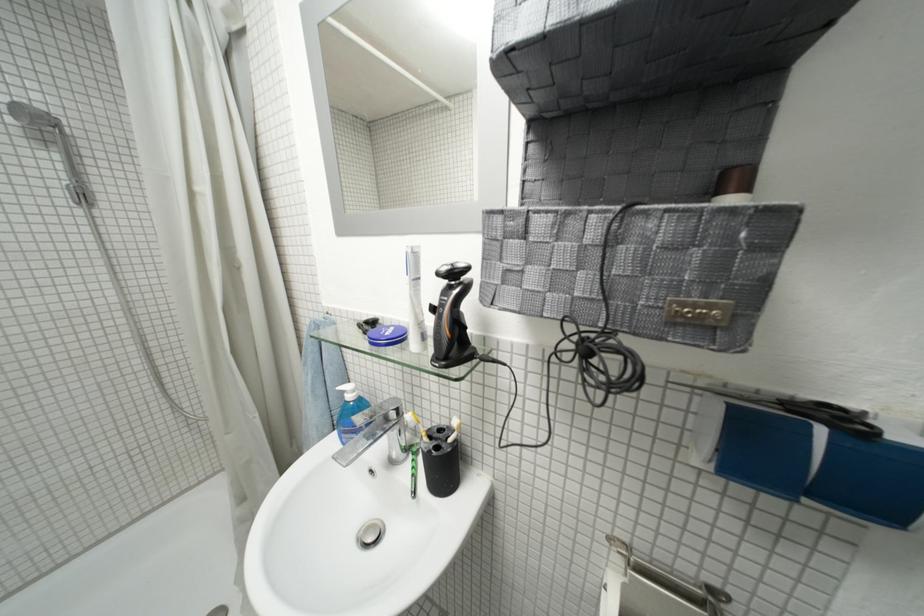
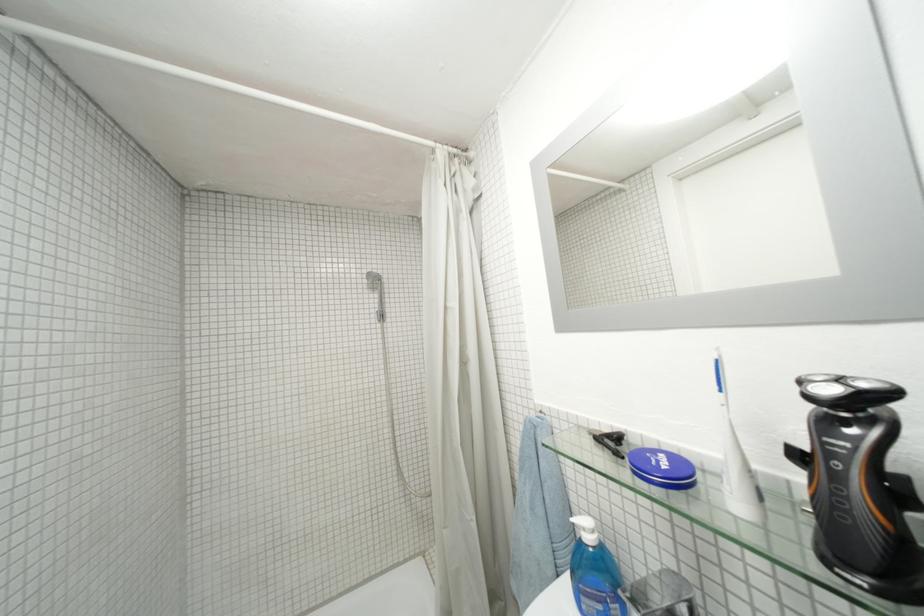
The point at (450,329) is marked in the first image. Where is the corresponding point in the second image?

(857, 501)